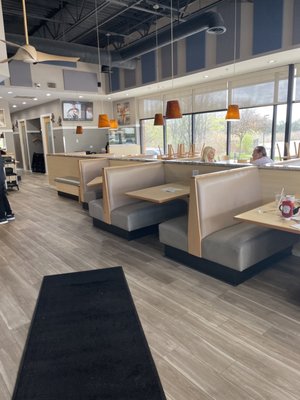
Locate an element on the screen. The image size is (300, 400). tv mounted on wall is located at coordinates (75, 107).